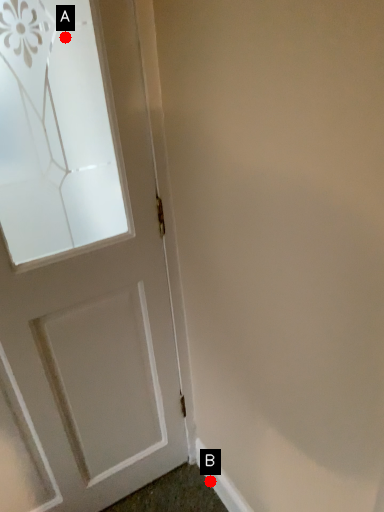
Question: Two points are circled on the image, labeled by A and B beside each circle. Which point is further to the camera?

Choices:
 (A) A is further
 (B) B is further

Answer: (B)